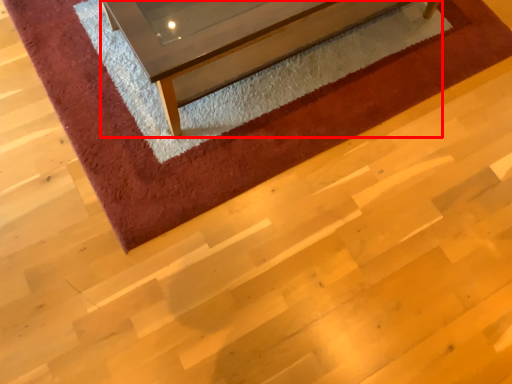
Question: From the image, what is the correct spatial relationship of furniture (annotated by the red box) in relation to mat?

Choices:
 (A) right
 (B) left

Answer: (A)